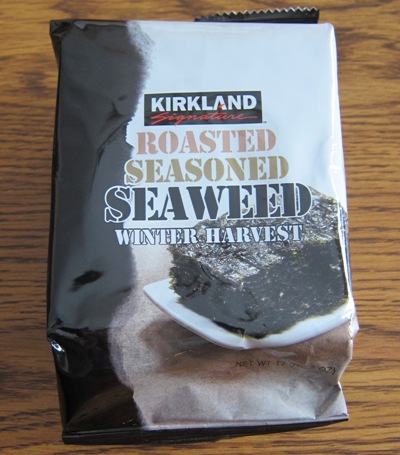
Find the location of a particular element. brown laminate wood table top is located at coordinates (384, 279), (30, 286).